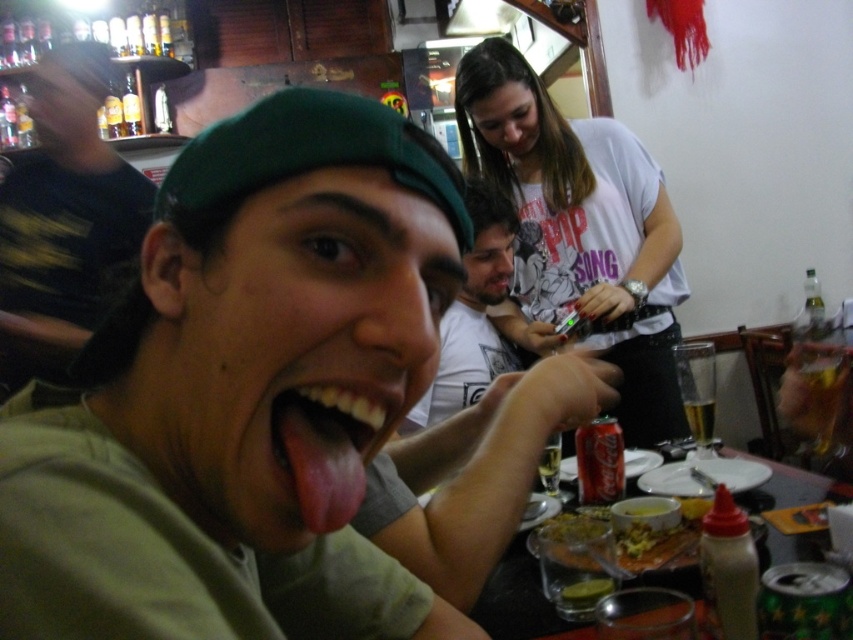
Is smooth plastic table at center to the right of yellowish matte pasta at lower center from the viewer's perspective?

Yes, smooth plastic table at center is to the right of yellowish matte pasta at lower center.

Does point (512, 608) come in front of point (643, 541)?

Yes, point (512, 608) is in front of point (643, 541).

Identify the location of smooth plastic table at center. The width and height of the screenshot is (853, 640). (517, 600).

Find the location of a particular element. Image resolution: width=853 pixels, height=640 pixels. green fabric cap at upper left is located at coordinates (65, 220).

The width and height of the screenshot is (853, 640). What do you see at coordinates (65, 220) in the screenshot? I see `green fabric cap at upper left` at bounding box center [65, 220].

Is point (45, 234) positioned before point (482, 616)?

No.

Identify the location of green fabric cap at upper left. (65, 220).

Between white cotton shirt at upper center and green fabric cap at upper left, which one has less height?

green fabric cap at upper left is shorter.

Does white cotton shirt at upper center have a greater width compared to green fabric cap at upper left?

Yes.

Is point (524, 227) in front of point (48, 371)?

No, it is behind (48, 371).

At what (x,y) coordinates should I click in order to perform the action: click on white cotton shirt at upper center. Please return your answer as a coordinate pair (x, y). Looking at the image, I should click on (579, 232).